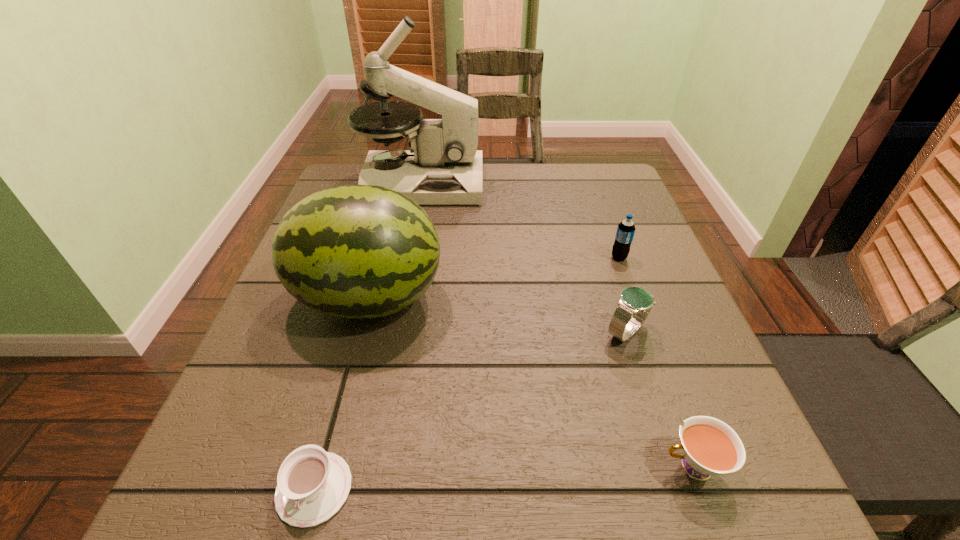
The height and width of the screenshot is (540, 960). I want to click on soda bottle located at the right edge, so [x=625, y=232].

Where is `watch located in the right edge section of the desktop`? Image resolution: width=960 pixels, height=540 pixels. watch located in the right edge section of the desktop is located at coordinates (635, 303).

Where is `teacup that is at the right edge`? teacup that is at the right edge is located at coordinates (710, 447).

The image size is (960, 540). In order to click on object that is positioned at the far left corner in this screenshot , I will do `click(443, 167)`.

The width and height of the screenshot is (960, 540). I want to click on object at the near left corner, so click(x=312, y=485).

This screenshot has width=960, height=540. Identify the location of object that is at the near right corner. (710, 447).

You are a GUI agent. You are given a task and a screenshot of the screen. Output one action in this format:
    pyautogui.click(x=<x>, y=<y>)
    Task: Click on the vacant space at the far edge of the desktop
    This screenshot has width=960, height=540.
    Given the screenshot: What is the action you would take?
    pyautogui.click(x=517, y=172)

Find the location of `vacant region at the left edge of the desktop`. vacant region at the left edge of the desktop is located at coordinates (328, 360).

In the image, there is a desktop. Identify the location of vacant region at the right edge. (635, 273).

Where is `vacant position at the far right corner of the desktop`? The width and height of the screenshot is (960, 540). vacant position at the far right corner of the desktop is located at coordinates (612, 185).